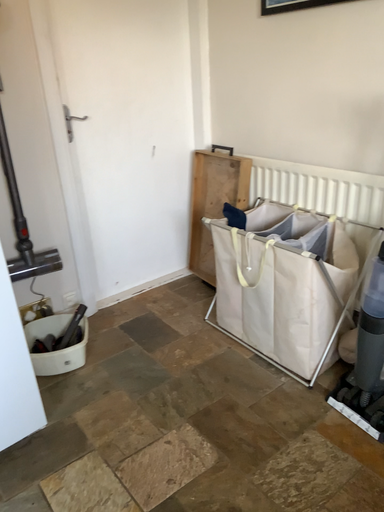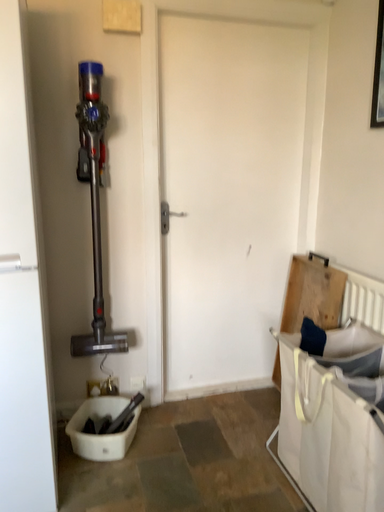
Question: How did the camera likely rotate when shooting the video?

Choices:
 (A) rotated left
 (B) rotated right

Answer: (A)